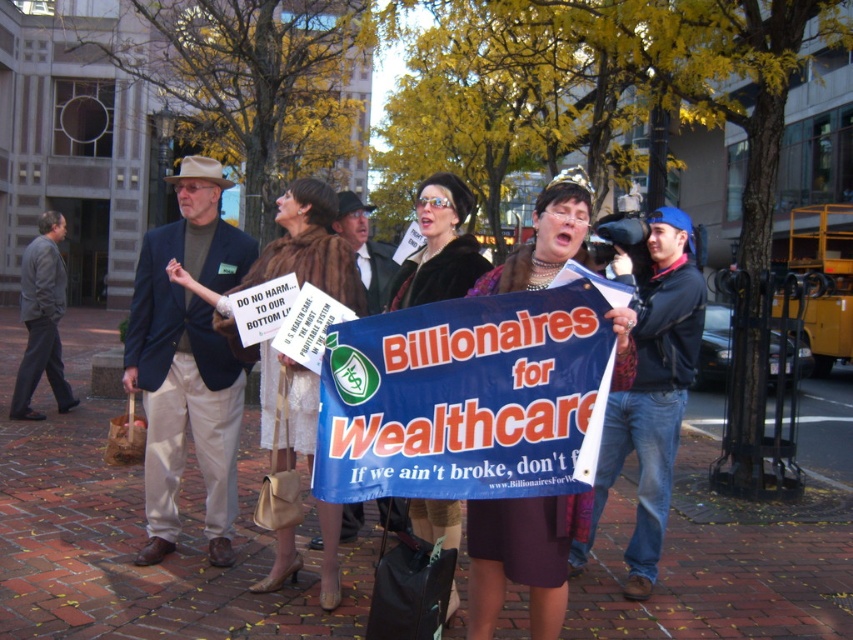
Between point (271, 362) and point (439, 214), which one is positioned behind?

The point (271, 362) is more distant.

The height and width of the screenshot is (640, 853). What are the coordinates of `brown fur coat at center` in the screenshot? It's located at (310, 246).

This screenshot has width=853, height=640. What do you see at coordinates (310, 246) in the screenshot?
I see `brown fur coat at center` at bounding box center [310, 246].

The image size is (853, 640). I want to click on brown fur coat at center, so click(x=310, y=246).

Which is below, brick pavement at center or brown fur coat at center?

brick pavement at center is below.

This screenshot has width=853, height=640. What do you see at coordinates (136, 531) in the screenshot?
I see `brick pavement at center` at bounding box center [136, 531].

Locate an element on the screen. The image size is (853, 640). brick pavement at center is located at coordinates (136, 531).

Where is `brick pavement at center`? The height and width of the screenshot is (640, 853). brick pavement at center is located at coordinates (136, 531).

Does brick pavement at center appear on the right side of velvet brown coat at center?

Incorrect, brick pavement at center is not on the right side of velvet brown coat at center.

Does point (33, 500) lie behind point (461, 198)?

Yes.

I want to click on brick pavement at center, so click(136, 531).